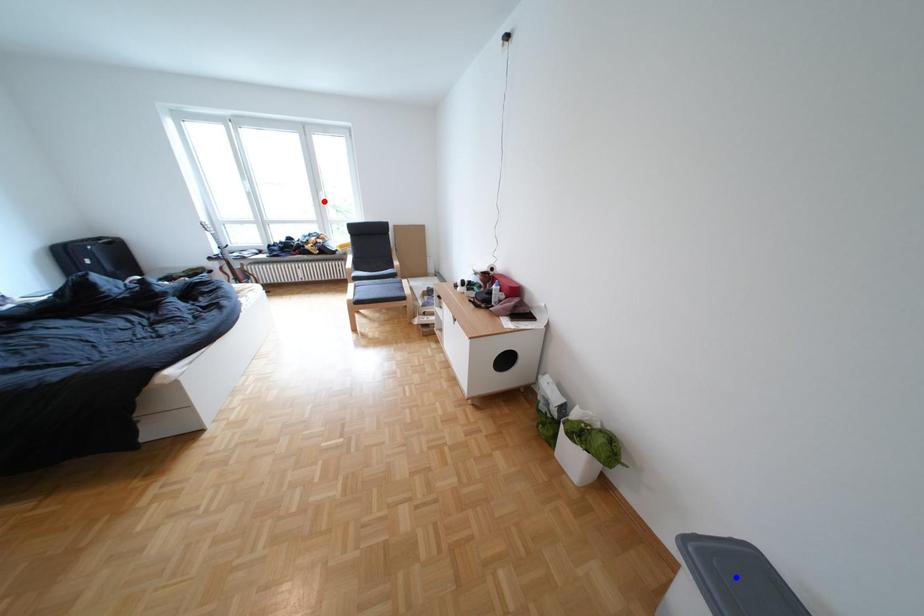
Question: Two points are marked on the image. Which point is closer to the camera?

Choices:
 (A) Blue point is closer.
 (B) Red point is closer.

Answer: (A)